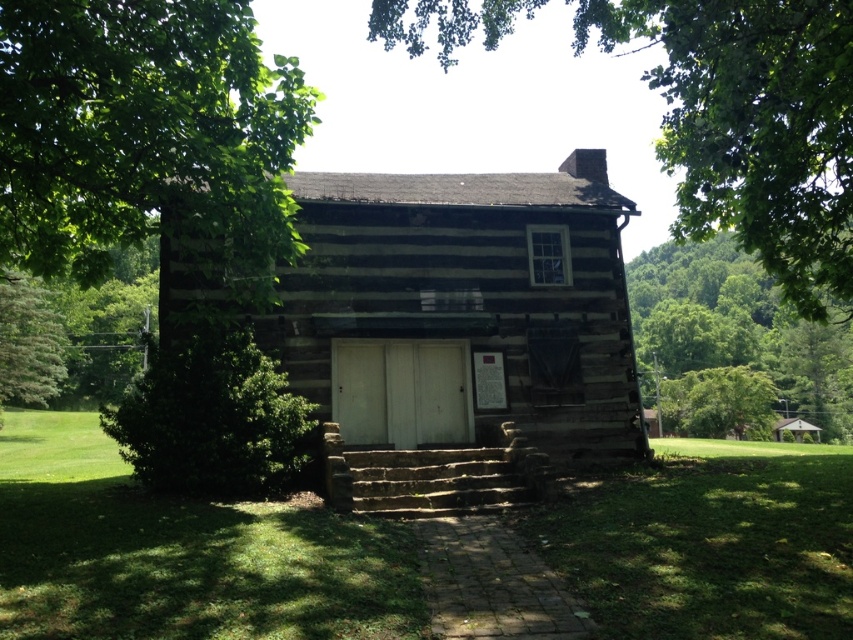
Is brown wooden cabin at center thinner than green leafy bush at lower left?

Yes, brown wooden cabin at center is thinner than green leafy bush at lower left.

Is brown wooden cabin at center positioned in front of green leafy bush at lower left?

Yes, brown wooden cabin at center is closer to the viewer.

This screenshot has width=853, height=640. Identify the location of brown wooden cabin at center. (457, 330).

The height and width of the screenshot is (640, 853). I want to click on brown wooden cabin at center, so click(x=457, y=330).

Consider the image. Which of these two, green leafy bush at lower left or green leafy tree at upper right, stands taller?

Standing taller between the two is green leafy tree at upper right.

The width and height of the screenshot is (853, 640). What do you see at coordinates (212, 416) in the screenshot?
I see `green leafy bush at lower left` at bounding box center [212, 416].

Find the location of a particular element. Image resolution: width=853 pixels, height=640 pixels. green leafy bush at lower left is located at coordinates (212, 416).

The height and width of the screenshot is (640, 853). Identify the location of green leafy bush at lower left. (212, 416).

Which is behind, point (573, 406) or point (791, 378)?

The point (791, 378) is more distant.

Does brown wooden cabin at center appear on the right side of green leafy tree at upper right?

No, brown wooden cabin at center is not to the right of green leafy tree at upper right.

Which is behind, point (473, 177) or point (759, 284)?

The point (759, 284) is behind.

Image resolution: width=853 pixels, height=640 pixels. Identify the location of brown wooden cabin at center. (457, 330).